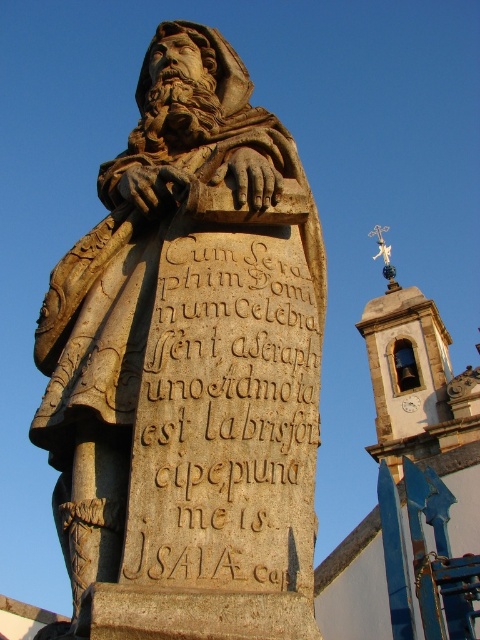
You are standing in front of the statue and want to read the inscription. Which direction should you move relative to the stone statue at center to face the brown stone inscription at center?

The stone statue at center is to the left of brown stone inscription at center, so you should move to the right of the stone statue at center to face the brown stone inscription at center.

You are standing in a park and see the stone statue at center. If you walk 10 meters north, will you still be able to see the statue?

Yes, because the statue is at point (x=190, y=368), which is centrally located, so moving north 10 meters would still keep it in view unless there are obstructions not mentioned in the scene description.

You are an art conservator examining the statue and its base. You need to clean both the stone statue at center and the brown stone inscription at center. Which one should you start with if you want to work on the part closest to you first?

You should start with the stone statue at center because it is closer to the viewer than the brown stone inscription at center.